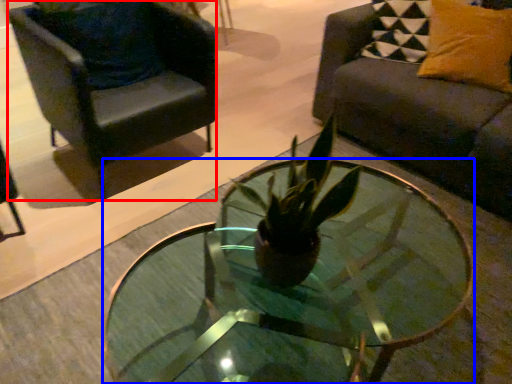
Question: Which point is closer to the camera, chair (highlighted by a red box) or coffee table (highlighted by a blue box)?

Choices:
 (A) chair
 (B) coffee table

Answer: (B)